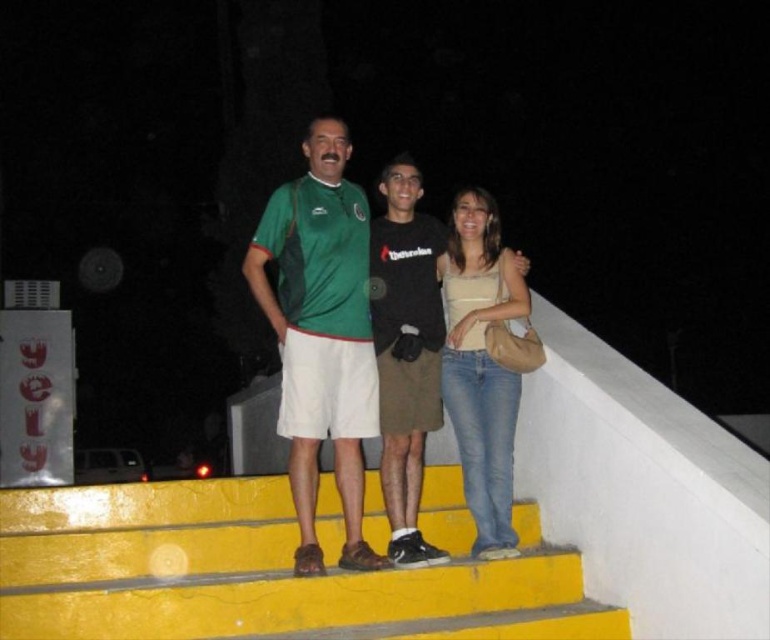
You are standing in front of the three people on the yellow stairs. You want to throw a small ball to the person who is closer to you. Which point should you aim for, point A at coordinates point [265,600] or point B at coordinates point [320,355]?

You should aim for point A at coordinates point [265,600] because it is closer to the viewer than point B at coordinates point [320,355].

You are a photographer trying to capture a wide shot of the scene. Given that the yellow painted stairs at center and the green fabric shirt at center are both in the frame, which one would require more space horizontally to fully include in the photo?

A: The yellow painted stairs at center requires more horizontal space because its width is larger than the green fabric shirt at center.

You are a photographer trying to capture a group photo of the green fabric shirt at center and the black cotton shirt at center. Since you want to ensure both shirts are clearly visible, which shirt should you focus on first considering their sizes?

The green fabric shirt at center is larger in width than the black cotton shirt at center, so you should focus on the green fabric shirt at center first to ensure its details are captured clearly before adjusting for the smaller one.